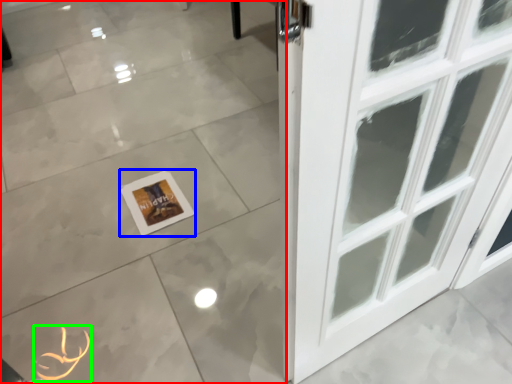
Question: Which is nearer to the ceramic tile (highlighted by a red box)? picture frame (highlighted by a blue box) or print (highlighted by a green box).

Choices:
 (A) picture frame
 (B) print

Answer: (A)